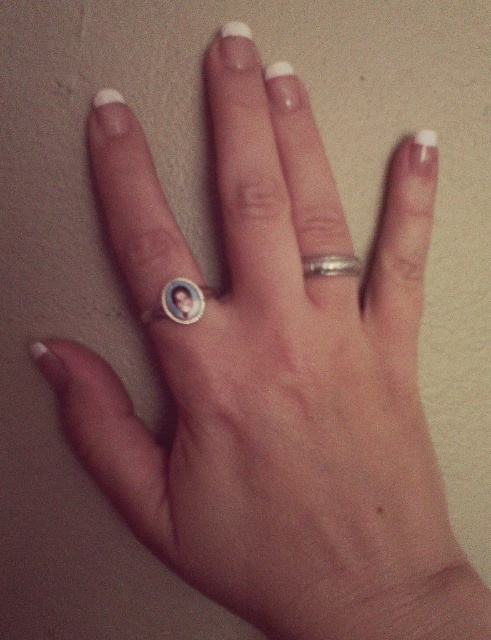
Is gold/enamel portrait ring at center above silver metallic ring at center?

Incorrect, gold/enamel portrait ring at center is not positioned above silver metallic ring at center.

Can you confirm if gold/enamel portrait ring at center is bigger than silver metallic ring at center?

Incorrect, gold/enamel portrait ring at center is not larger than silver metallic ring at center.

What do you see at coordinates (183, 300) in the screenshot?
I see `gold/enamel portrait ring at center` at bounding box center [183, 300].

The width and height of the screenshot is (491, 640). What are the coordinates of `gold/enamel portrait ring at center` in the screenshot? It's located at (183, 300).